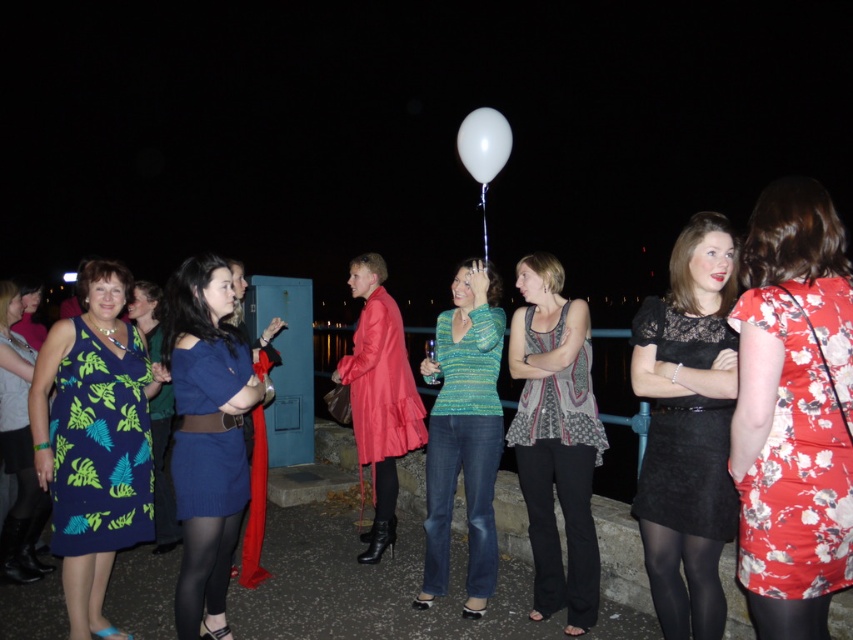
What do you see at coordinates (560, 408) in the screenshot?
I see `printed cotton tank top at center` at bounding box center [560, 408].

Who is more forward, [578,394] or [654,605]?

Point [654,605] is more forward.

Who is more distant from viewer, (550,429) or (712,552)?

The point (550,429) is behind.

The width and height of the screenshot is (853, 640). What are the coordinates of `printed cotton tank top at center` in the screenshot? It's located at (560, 408).

Which is more to the left, blue knitted dress at center or green leafy dress at left?

Positioned to the left is green leafy dress at left.

Who is taller, blue knitted dress at center or green leafy dress at left?

green leafy dress at left

Identify the location of blue knitted dress at center. Image resolution: width=853 pixels, height=640 pixels. (209, 474).

The width and height of the screenshot is (853, 640). I want to click on blue knitted dress at center, so click(x=209, y=474).

Which is behind, point (4, 288) or point (200, 600)?

The point (4, 288) is behind.

Is point (19, 394) more distant than point (198, 528)?

Yes.

Measure the distance between point (3, 292) and camera.

Point (3, 292) is 4.39 meters away from camera.

This screenshot has height=640, width=853. What are the coordinates of `green leafy dress at left` in the screenshot? It's located at (18, 449).